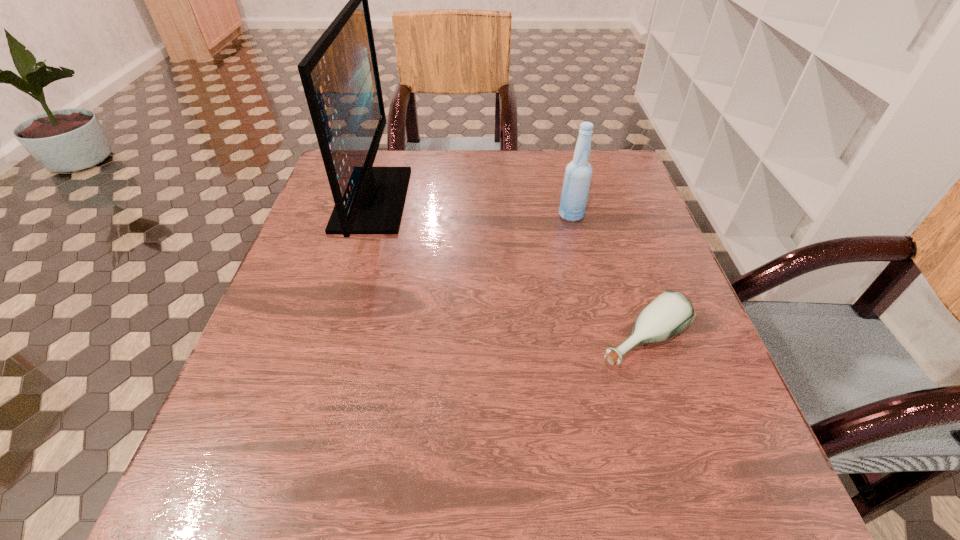
The height and width of the screenshot is (540, 960). Find the location of `vacant point located between the monitor and the taller bottle`. vacant point located between the monitor and the taller bottle is located at coordinates (471, 207).

Locate an element on the screen. The width and height of the screenshot is (960, 540). empty space that is in between the taller bottle and the nearest object is located at coordinates (607, 278).

Where is `free space between the monitor and the second shortest object`? The width and height of the screenshot is (960, 540). free space between the monitor and the second shortest object is located at coordinates (471, 207).

Locate an element on the screen. The width and height of the screenshot is (960, 540). blank region between the shortest object and the monitor is located at coordinates (507, 270).

Where is `free spot between the taller bottle and the leftmost object`? free spot between the taller bottle and the leftmost object is located at coordinates (471, 207).

Where is `blank region between the shorter bottle and the monitor`? blank region between the shorter bottle and the monitor is located at coordinates (507, 270).

Find the location of a particular element. This screenshot has width=960, height=540. vacant point located between the taller bottle and the nearer bottle is located at coordinates (607, 278).

Locate an element on the screen. This screenshot has width=960, height=540. object that is the second closest one to the taller bottle is located at coordinates (340, 77).

Identify which object is the nearest to the tallest object. Please provide its 2D coordinates. Your answer should be formatted as a tuple, i.e. [(x, y)], where the tuple contains the x and y coordinates of a point satisfying the conditions above.

[(578, 173)]

Image resolution: width=960 pixels, height=540 pixels. What are the coordinates of `free space that satisfies the following two spatial constraints: 1. on the back side of the second tallest object; 2. on the screen side of the leftmost object` in the screenshot? It's located at (567, 199).